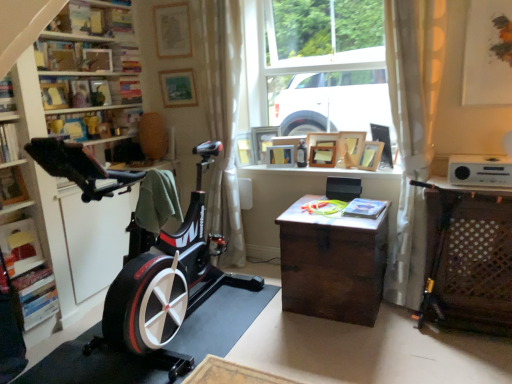
Question: Is white sheer curtain at center, arranged as the 1th curtain when viewed from the left, not within wooden chest at center?

Choices:
 (A) no
 (B) yes

Answer: (B)

Question: Considering the relative sizes of white sheer curtain at center, arranged as the 1th curtain when viewed from the left, and wooden chest at center in the image provided, is white sheer curtain at center, arranged as the 1th curtain when viewed from the left, shorter than wooden chest at center?

Choices:
 (A) no
 (B) yes

Answer: (A)

Question: Considering the relative sizes of white sheer curtain at center, arranged as the 1th curtain when viewed from the left, and wooden chest at center in the image provided, is white sheer curtain at center, arranged as the 1th curtain when viewed from the left, bigger than wooden chest at center?

Choices:
 (A) yes
 (B) no

Answer: (A)

Question: Is the surface of white sheer curtain at center, arranged as the 1th curtain when viewed from the left, in direct contact with wooden chest at center?

Choices:
 (A) yes
 (B) no

Answer: (B)

Question: From a real-world perspective, is white sheer curtain at center, arranged as the 1th curtain when viewed from the left, physically below wooden chest at center?

Choices:
 (A) no
 (B) yes

Answer: (A)

Question: From their relative heights in the image, would you say wooden picture frame at upper center, acting as the fourth picture frame starting from the right, is taller or shorter than wooden picture frame at upper center, the 3th picture frame when ordered from right to left?

Choices:
 (A) short
 (B) tall

Answer: (B)

Question: Is wooden picture frame at upper center, placed as the eighth picture frame when sorted from left to right, situated inside wooden picture frame at upper center, arranged as the ninth picture frame when viewed from the left, or outside?

Choices:
 (A) inside
 (B) outside

Answer: (B)

Question: Would you say wooden picture frame at upper center, placed as the eighth picture frame when sorted from left to right, is to the left or to the right of wooden picture frame at upper center, the 3th picture frame when ordered from right to left, in the picture?

Choices:
 (A) right
 (B) left

Answer: (B)

Question: Looking at their shapes, would you say wooden picture frame at upper center, placed as the eighth picture frame when sorted from left to right, is wider or thinner than wooden picture frame at upper center, the 3th picture frame when ordered from right to left?

Choices:
 (A) wide
 (B) thin

Answer: (A)

Question: Which is correct: hardcover book at center, positioned as the 1th book in bottom-to-top order, is inside matte wood shelf at upper left, the third shelf from the front, or outside of it?

Choices:
 (A) outside
 (B) inside

Answer: (A)

Question: Looking at their shapes, would you say hardcover book at center, the 1th book in the right-to-left sequence, is wider or thinner than matte wood shelf at upper left, the third shelf from the front?

Choices:
 (A) wide
 (B) thin

Answer: (A)

Question: From the image's perspective, is hardcover book at center, arranged as the third book when viewed from the left, above or below matte wood shelf at upper left, the third shelf from the front?

Choices:
 (A) below
 (B) above

Answer: (A)

Question: Looking at the image, does hardcover book at center, the third book in the top-to-bottom sequence, seem bigger or smaller compared to matte wood shelf at upper left, the third shelf from the front?

Choices:
 (A) small
 (B) big

Answer: (A)

Question: In terms of size, does wooden picture frame at center, the 8th picture frame viewed from the right, appear bigger or smaller than hardcover book at left, which is the third book in bottom-to-top order?

Choices:
 (A) small
 (B) big

Answer: (B)

Question: Does point (264, 152) appear closer or farther from the camera than point (6, 97)?

Choices:
 (A) closer
 (B) farther

Answer: (B)